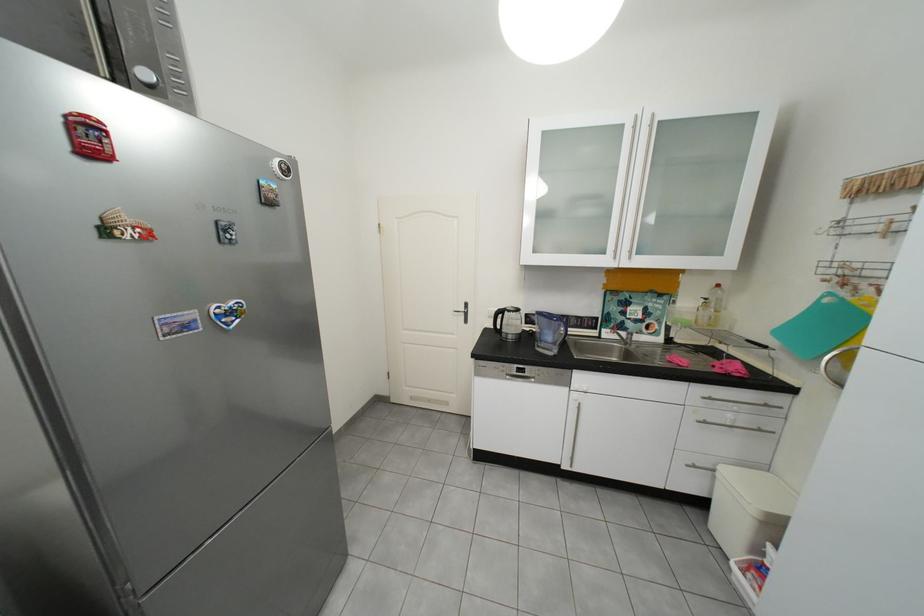
The width and height of the screenshot is (924, 616). I want to click on gray binder, so click(108, 42).